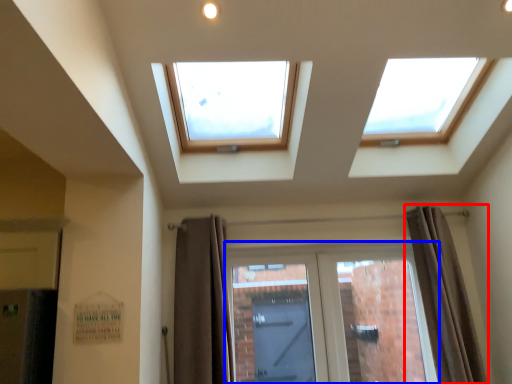
Question: Which point is further to the camera, curtain (highlighted by a red box) or door (highlighted by a blue box)?

Choices:
 (A) curtain
 (B) door

Answer: (B)